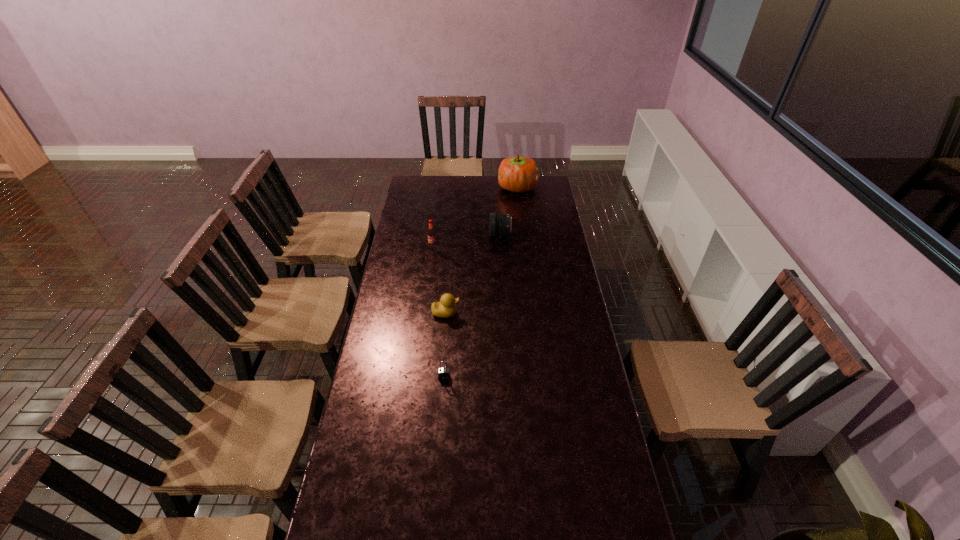
The width and height of the screenshot is (960, 540). Identify the location of blank space at the right edge of the desktop. (589, 377).

Where is `free space between the duckling and the second tallest object`? This screenshot has height=540, width=960. free space between the duckling and the second tallest object is located at coordinates click(x=440, y=280).

Locate an element on the screen. free spot between the telephoto lens and the fourth shortest object is located at coordinates (467, 241).

Where is `empty space that is in between the padlock and the telephoto lens`? empty space that is in between the padlock and the telephoto lens is located at coordinates (472, 306).

Image resolution: width=960 pixels, height=540 pixels. What are the coordinates of `free space between the fourth shortest object and the tallest object` in the screenshot? It's located at (475, 217).

At what (x,y) coordinates should I click in order to perform the action: click on empty space between the second tallest object and the farthest object. Please return your answer as a coordinate pair (x, y). Looking at the image, I should click on (475, 217).

Find the location of a particular element. The image size is (960, 540). free point between the padlock and the duckling is located at coordinates (444, 345).

This screenshot has height=540, width=960. What are the coordinates of `object that is the fourth closest one to the nearest object` in the screenshot? It's located at (520, 174).

Image resolution: width=960 pixels, height=540 pixels. Identify the location of object that is the fourth closest one to the duckling. (520, 174).